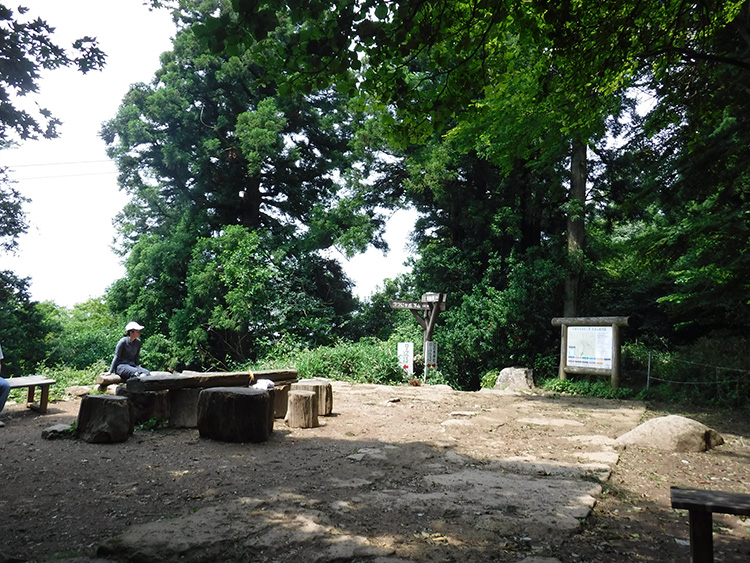
Identify the location of rock table. This screenshot has height=563, width=750. (192, 379).